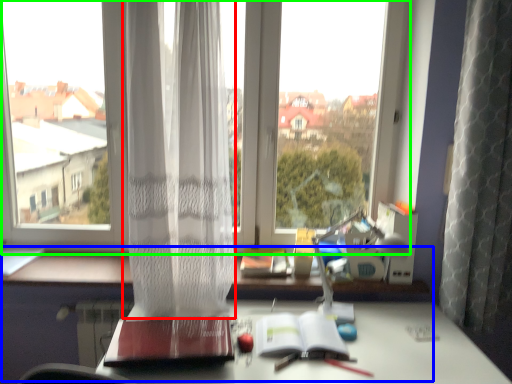
Question: Which object is the closest to the curtain (highlighted by a red box)? Choose among these: computer desk (highlighted by a blue box) or window (highlighted by a green box).

Choices:
 (A) computer desk
 (B) window

Answer: (B)